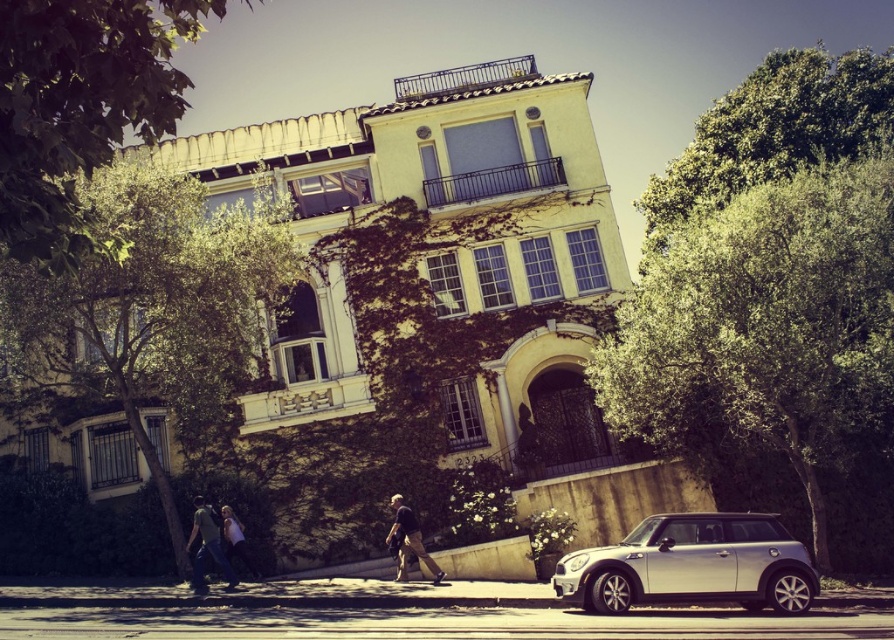
Question: Does khaki cotton pants at center have a greater width compared to denim jacket at lower left?

Choices:
 (A) yes
 (B) no

Answer: (B)

Question: Does green leafy tree at left have a smaller size compared to denim jacket at lower left?

Choices:
 (A) no
 (B) yes

Answer: (A)

Question: Which object is farther from the camera taking this photo?

Choices:
 (A) khaki cotton pants at center
 (B) denim jacket at lower left
 (C) green leafy tree at upper left

Answer: (A)

Question: Which point appears closest to the camera in this image?

Choices:
 (A) (232, 540)
 (B) (770, 440)
 (C) (398, 545)
 (D) (699, 568)

Answer: (D)

Question: Where is green leafy tree at left located in relation to denim jacket at lower left in the image?

Choices:
 (A) below
 (B) above

Answer: (B)

Question: Which object is positioned closest to the green leafy tree at right?

Choices:
 (A) green leafy tree at upper left
 (B) denim jacket at lower left

Answer: (B)